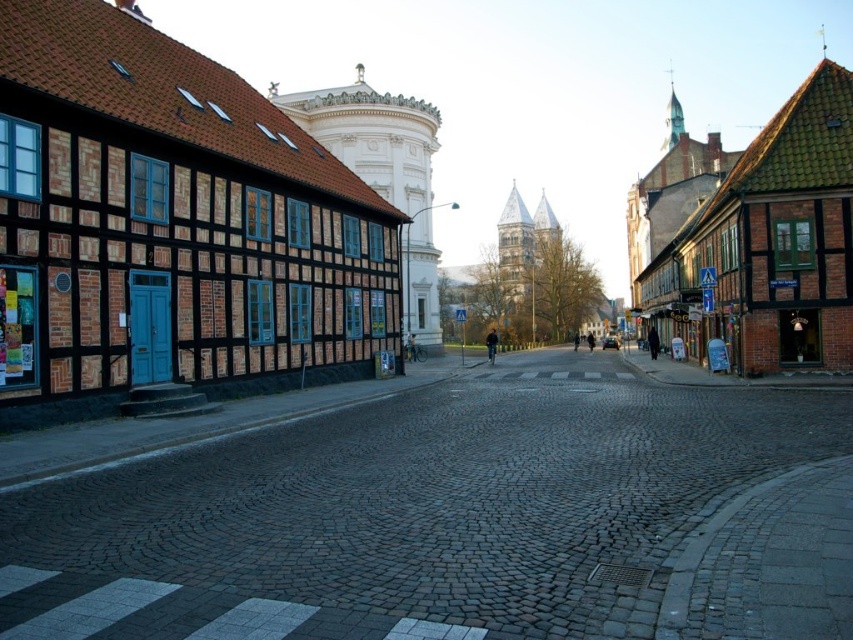
Question: Which point appears farthest from the camera in this image?

Choices:
 (A) click(144, 218)
 (B) click(759, 240)

Answer: (B)

Question: From the image, what is the correct spatial relationship of matte brick building at left in relation to brown wooden house at right?

Choices:
 (A) right
 (B) left

Answer: (B)

Question: Is matte brick building at left in front of brown wooden building at left?

Choices:
 (A) yes
 (B) no

Answer: (A)

Question: Which of these objects is positioned closest to the matte brick building at left?

Choices:
 (A) brown wooden house at right
 (B) brown wooden building at left

Answer: (B)

Question: Can you confirm if matte brick building at left is smaller than brown wooden building at left?

Choices:
 (A) yes
 (B) no

Answer: (A)

Question: Considering the real-world distances, which object is farthest from the brown wooden building at left?

Choices:
 (A) matte brick building at left
 (B) brown wooden house at right

Answer: (B)